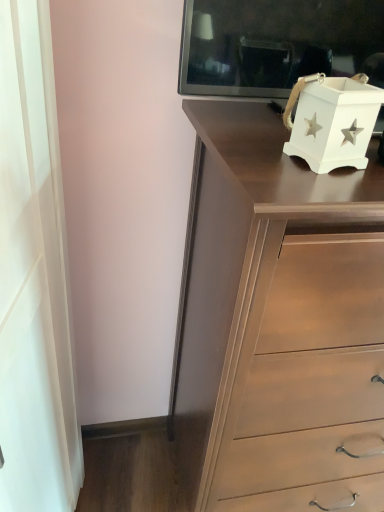
Identify the location of free space in front of white matte box at upper right. The width and height of the screenshot is (384, 512). (321, 192).